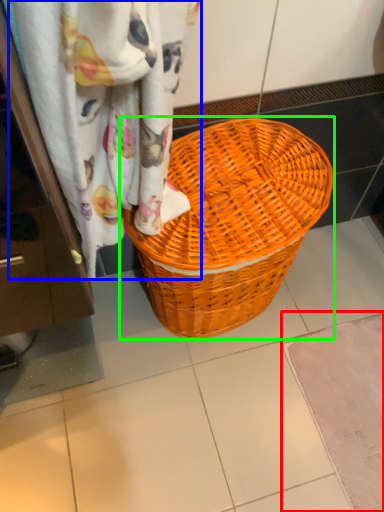
Question: Which object is the closest to the bath mat (highlighted by a red box)? Choose among these: curtain (highlighted by a blue box) or picnic basket (highlighted by a green box).

Choices:
 (A) curtain
 (B) picnic basket

Answer: (B)